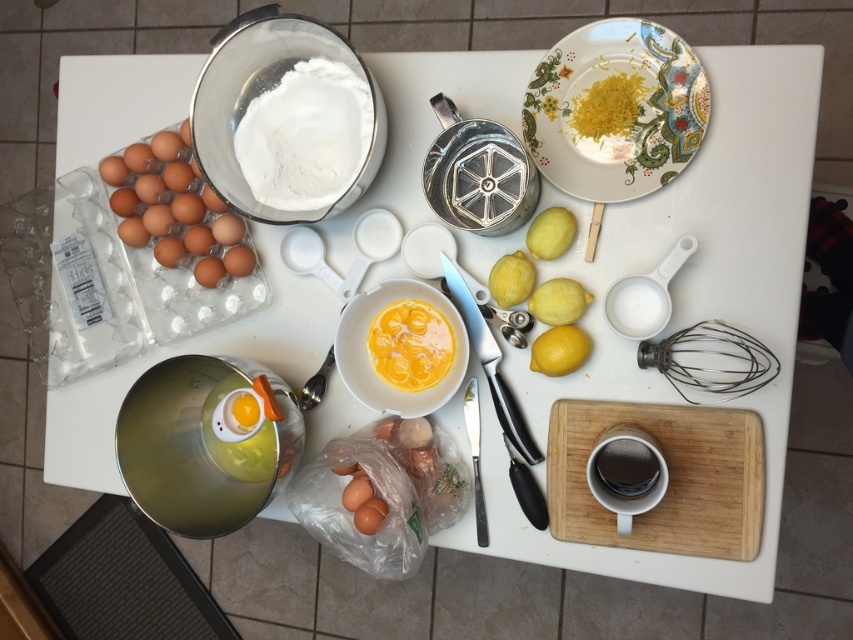
You are a baker who needs to measure the flour. You see the white powder flour at upper left and the brown matte egg at left. Which of these items is closer to you?

The white powder flour at upper left is closer to the viewer than the brown matte egg at left.